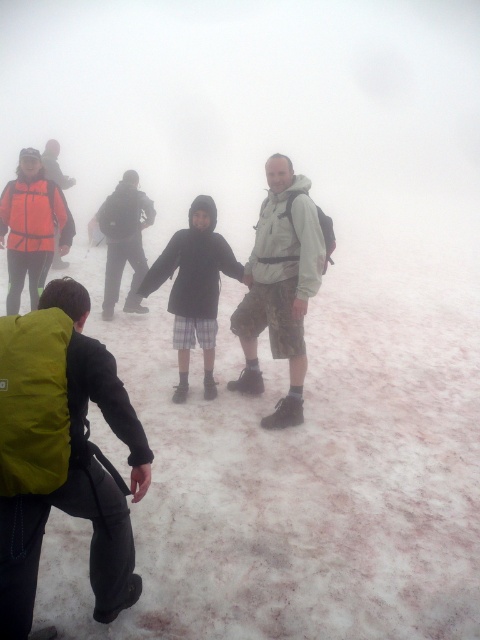
Is camouflage shorts at center to the left of orange reflective jacket at left from the viewer's perspective?

In fact, camouflage shorts at center is to the right of orange reflective jacket at left.

Is camouflage shorts at center in front of orange reflective jacket at left?

Yes, it is in front of orange reflective jacket at left.

Does point (257, 308) lie behind point (37, 193)?

That is False.

The width and height of the screenshot is (480, 640). Find the location of `camouflage shorts at center`. camouflage shorts at center is located at coordinates (279, 285).

Measure the distance between matte black jacket at center and orange reflective jacket at left.

matte black jacket at center is 1.72 meters from orange reflective jacket at left.

Which is in front, point (172, 307) or point (37, 211)?

Point (172, 307)

Looking at this image, who is more distant from viewer, [177,237] or [54,244]?

The point [54,244] is more distant.

Identify the location of matte black jacket at center. The width and height of the screenshot is (480, 640). (193, 289).

Identify the location of green fabric backpack at lower left. (68, 468).

Does point (7, 547) lie behind point (245, 308)?

No, it is not.

The image size is (480, 640). What are the coordinates of `green fabric backpack at lower left` in the screenshot? It's located at (68, 468).